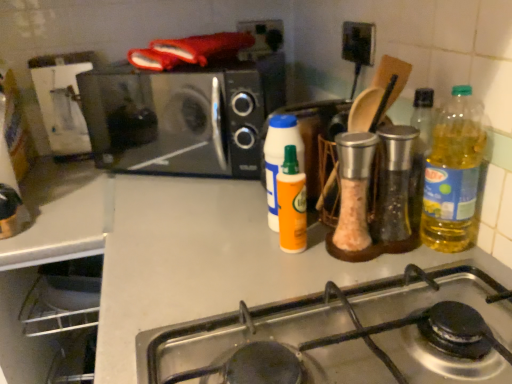
Question: Does point pyautogui.click(x=382, y=135) appear closer or farther from the camera than point pyautogui.click(x=438, y=248)?

Choices:
 (A) closer
 (B) farther

Answer: (A)

Question: Considering the positions of translucent glass oil at center right, placed as the third bottle when sorted from left to right, and yellow translucent bottle at right, placed as the fourth bottle when sorted from left to right, in the image, is translucent glass oil at center right, placed as the third bottle when sorted from left to right, bigger or smaller than yellow translucent bottle at right, placed as the fourth bottle when sorted from left to right,?

Choices:
 (A) small
 (B) big

Answer: (A)

Question: Which object is positioned farthest from the black matte microwave at upper left?

Choices:
 (A) orange matte bottle at center, which appears as the 4th bottle when viewed from the right
 (B) yellow translucent bottle at right, the 1th bottle from the right
 (C) stainless steel gas stove at lower center
 (D) orange matte spray can at center, acting as the second bottle starting from the left
 (E) translucent glass oil at center right, which ranks as the 2th bottle in right-to-left order

Answer: (C)

Question: Which of these objects is positioned farthest from the orange matte bottle at center, which is the first bottle in left-to-right order?

Choices:
 (A) yellow translucent bottle at right, the 1th bottle from the right
 (B) translucent glass oil at center right, which ranks as the 2th bottle in right-to-left order
 (C) black matte microwave at upper left
 (D) orange matte spray can at center, acting as the second bottle starting from the left
 (E) stainless steel gas stove at lower center

Answer: (C)